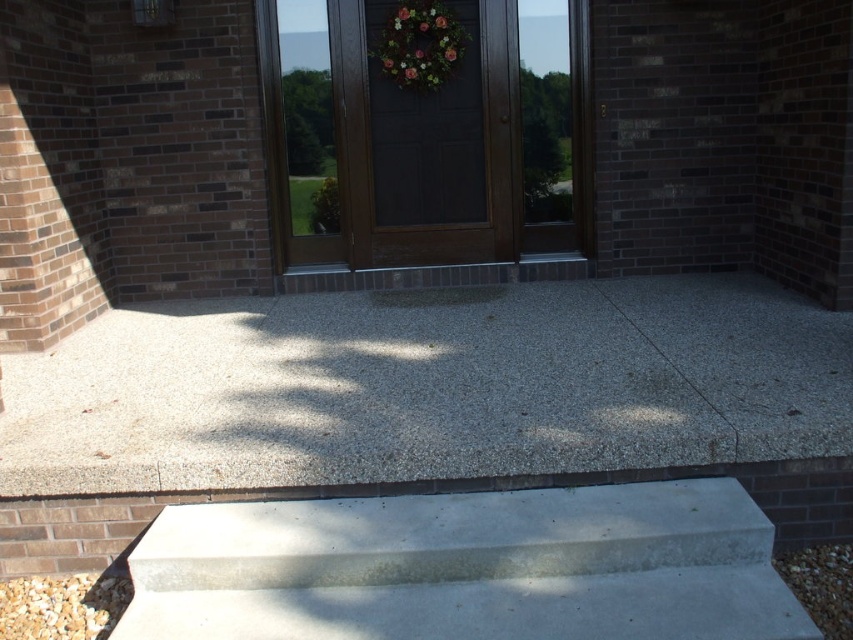
You are a delivery person holding a large package that requires placing it precisely between the dark wood door at center and the green leafy wreath at center. Given that the space between them is only 12.89 inches, can you fit the package without touching either object?

The dark wood door at center is 12.89 inches from the green leafy wreath at center. Since the package needs to be placed precisely between them, there is insufficient space to fit it without touching either object.

You are a delivery person carrying a large package and need to place it on the ground near the dark wood door at center. The package is 1.2 meters wide. Can the smooth concrete step at center accommodate the package without overhanging the edges?

The smooth concrete step at center is wider than the dark wood door at center. Since the package is 1.2 meters wide, it should fit on the step as long as the step is wide enough to accommodate that width. However, the exact width of the step isn not specified, so we cannot confirm for certain. But since the step is wider than the door, which might be standard width, it might be possible.